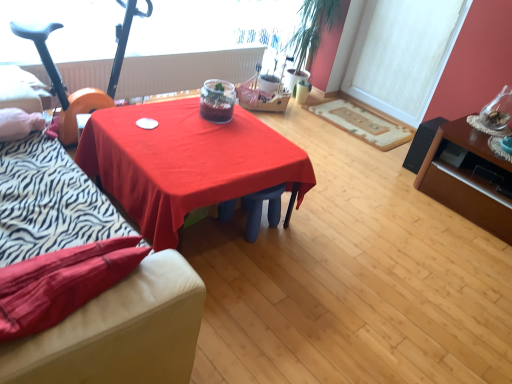
Question: Does matte black speaker at right, the second table positioned from the left, have a lesser height compared to green leafy plant at upper right?

Choices:
 (A) yes
 (B) no

Answer: (A)

Question: Is matte black speaker at right, the second table positioned from the left, facing towards green leafy plant at upper right?

Choices:
 (A) yes
 (B) no

Answer: (B)

Question: Considering the relative sizes of matte black speaker at right, the second table positioned from the left, and green leafy plant at upper right in the image provided, is matte black speaker at right, the second table positioned from the left, taller than green leafy plant at upper right?

Choices:
 (A) yes
 (B) no

Answer: (B)

Question: From the image's perspective, is matte black speaker at right, the second table positioned from the left, over green leafy plant at upper right?

Choices:
 (A) no
 (B) yes

Answer: (A)

Question: From a real-world perspective, does matte black speaker at right, the second table positioned from the left, sit lower than green leafy plant at upper right?

Choices:
 (A) yes
 (B) no

Answer: (A)

Question: Considering the relative sizes of matte black speaker at right, the second table positioned from the left, and green leafy plant at upper right in the image provided, is matte black speaker at right, the second table positioned from the left, thinner than green leafy plant at upper right?

Choices:
 (A) yes
 (B) no

Answer: (B)

Question: Is orange rubber baby carriage at left with velvet-like red couch at lower left?

Choices:
 (A) yes
 (B) no

Answer: (B)

Question: Is orange rubber baby carriage at left wider than velvet-like red couch at lower left?

Choices:
 (A) no
 (B) yes

Answer: (B)

Question: From the image's perspective, is orange rubber baby carriage at left located beneath velvet-like red couch at lower left?

Choices:
 (A) yes
 (B) no

Answer: (B)

Question: Does orange rubber baby carriage at left lie in front of velvet-like red couch at lower left?

Choices:
 (A) no
 (B) yes

Answer: (A)

Question: Is orange rubber baby carriage at left aimed at velvet-like red couch at lower left?

Choices:
 (A) yes
 (B) no

Answer: (A)

Question: Can you confirm if orange rubber baby carriage at left is shorter than velvet-like red couch at lower left?

Choices:
 (A) yes
 (B) no

Answer: (B)

Question: Is matte black speaker at right, acting as the 1th table starting from the right, to the left of white textured window screen at upper right from the viewer's perspective?

Choices:
 (A) yes
 (B) no

Answer: (B)